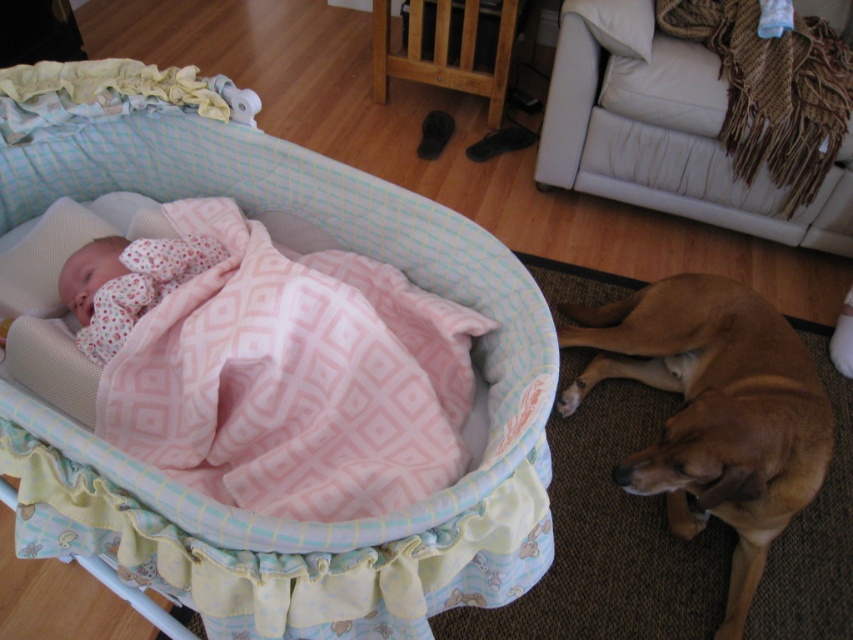
This screenshot has height=640, width=853. Find the location of `pink fabric infant bed at center`. pink fabric infant bed at center is located at coordinates (236, 509).

Is point (129, 538) positioned behind point (115, 280)?

No.

Find the location of a particular element. pink fabric infant bed at center is located at coordinates pyautogui.click(x=236, y=509).

Is point (430, 250) positioned before point (668, 476)?

No, it is behind (668, 476).

Can you confirm if pink fabric infant bed at center is taller than brown smooth dog at lower right?

Correct, pink fabric infant bed at center is much taller as brown smooth dog at lower right.

Does point (96, 76) come behind point (648, 458)?

That is True.

What are the coordinates of `pink fabric infant bed at center` in the screenshot? It's located at pyautogui.click(x=236, y=509).

Who is taller, brown smooth dog at lower right or fluffy pink blanket at center?

brown smooth dog at lower right

From the picture: Who is shorter, brown smooth dog at lower right or fluffy pink blanket at center?

fluffy pink blanket at center is shorter.

Find the location of a particular element. brown smooth dog at lower right is located at coordinates (712, 412).

Find the location of a particular element. brown smooth dog at lower right is located at coordinates (712, 412).